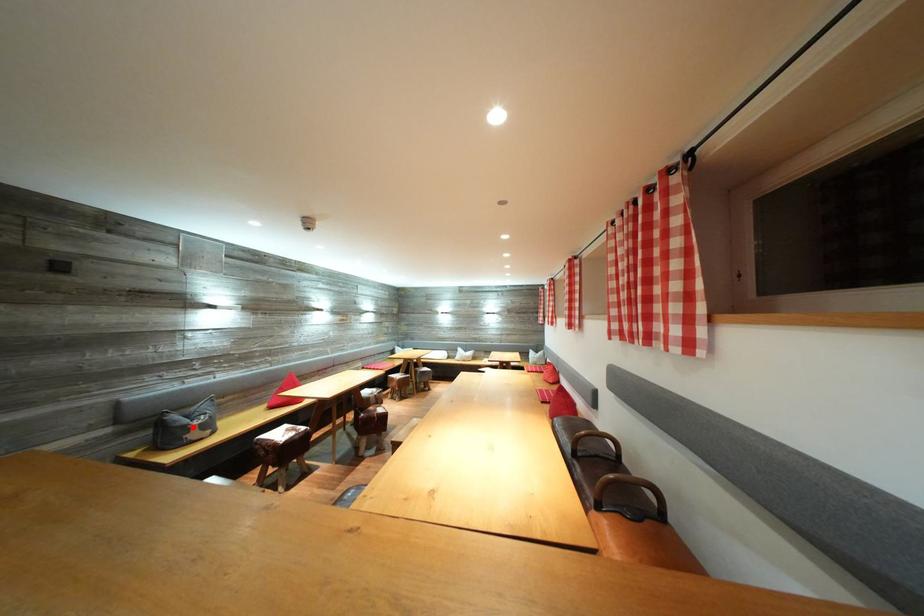
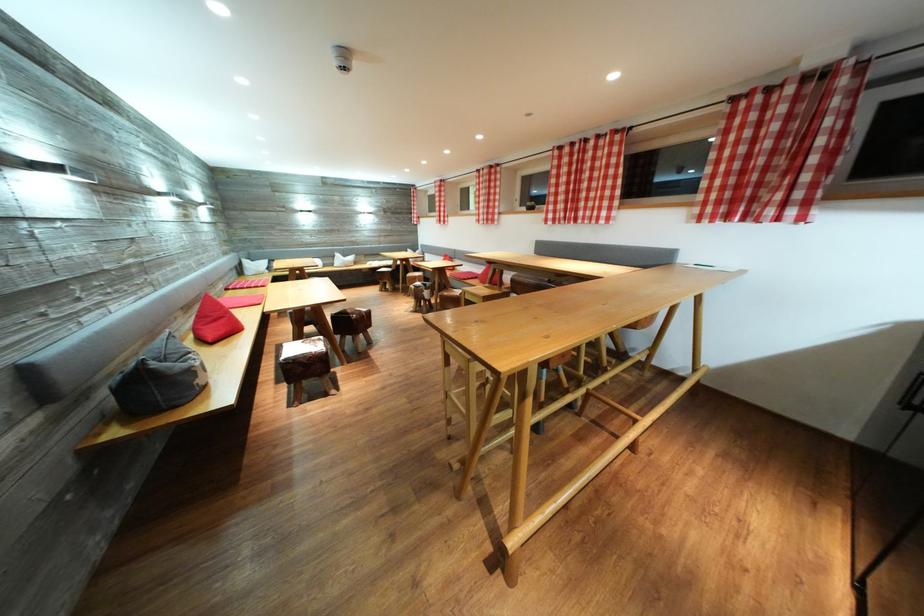
The point at the highlighted location is marked in the first image. Where is the corresponding point in the second image?

(187, 371)